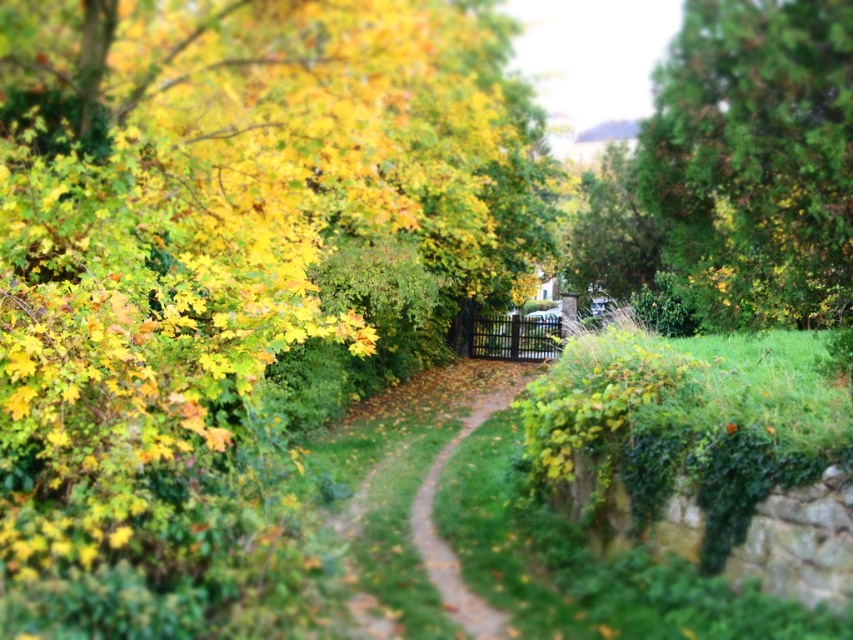
Can you confirm if green textured tree at upper right is bigger than green grassy trail at center?

Indeed, green textured tree at upper right has a larger size compared to green grassy trail at center.

Is green textured tree at upper right smaller than green grassy trail at center?

Incorrect, green textured tree at upper right is not smaller in size than green grassy trail at center.

The image size is (853, 640). What do you see at coordinates (735, 170) in the screenshot? I see `green textured tree at upper right` at bounding box center [735, 170].

Locate an element on the screen. This screenshot has width=853, height=640. green textured tree at upper right is located at coordinates [x=735, y=170].